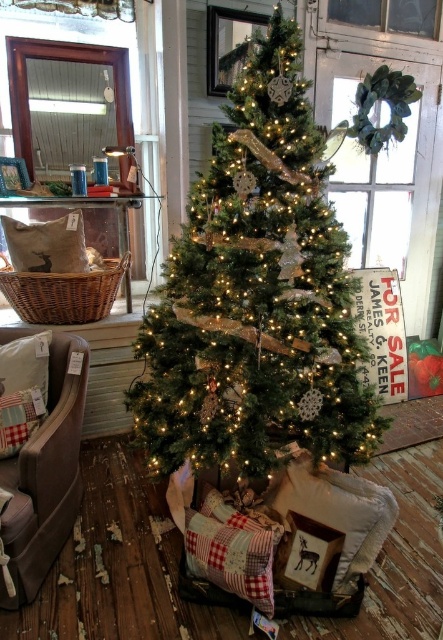
Question: Does green matte christmas tree at center appear over velvet beige armchair at lower left?

Choices:
 (A) no
 (B) yes

Answer: (B)

Question: Is green matte christmas tree at center behind velvet beige armchair at lower left?

Choices:
 (A) no
 (B) yes

Answer: (B)

Question: Observing the image, what is the correct spatial positioning of green matte christmas tree at center in reference to velvet beige armchair at lower left?

Choices:
 (A) below
 (B) above

Answer: (B)